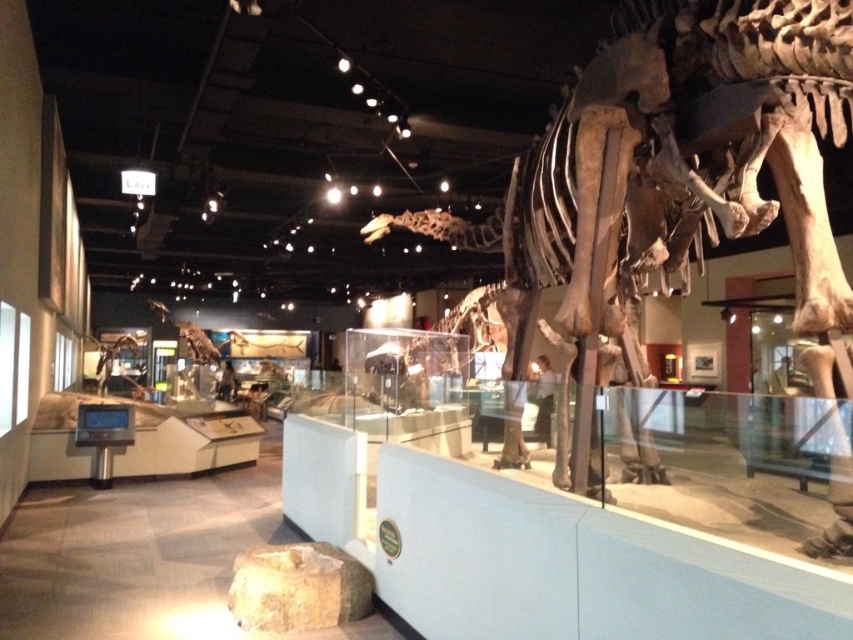
You are a visitor standing in front of the shiny metallic dinosaur at lower left in the museum. The museum has a strict rule that visitors must stay at least 15 meters away from all exhibits. Are you in compliance with this rule?

The distance between the shiny metallic dinosaur at lower left and the viewer is 14.90 meters, which is less than the required 15 meters. Therefore, you are not in compliance with the museum rule and should move further back.

You are a visitor in the museum and want to take a photo of both the shiny metallic dinosaur at lower left and the shiny metallic dinosaur skeleton at center. Which one should you stand closer to in order to capture both in a single frame?

You should stand closer to the shiny metallic dinosaur skeleton at center because the shiny metallic dinosaur at lower left is taller than it, so by positioning yourself closer to the shorter one, both can be included in the photo.

You are a visitor at the museum and want to take a photo of both the shiny metallic dinosaur at lower left and the shiny metallic dinosaur skeleton at center. Since there is a glass barrier in front of you, can you position yourself in a way that both objects are visible in the same frame?

Yes, since the shiny metallic dinosaur at lower left is to the left of the shiny metallic dinosaur skeleton at center, you can position yourself to the left of both objects and angle the camera to include both in the frame through the glass barrier.